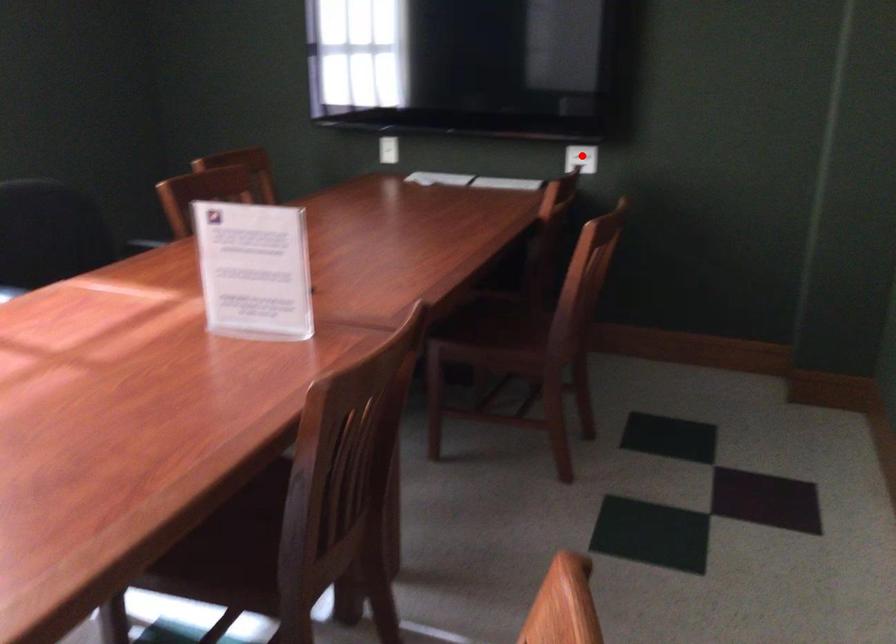
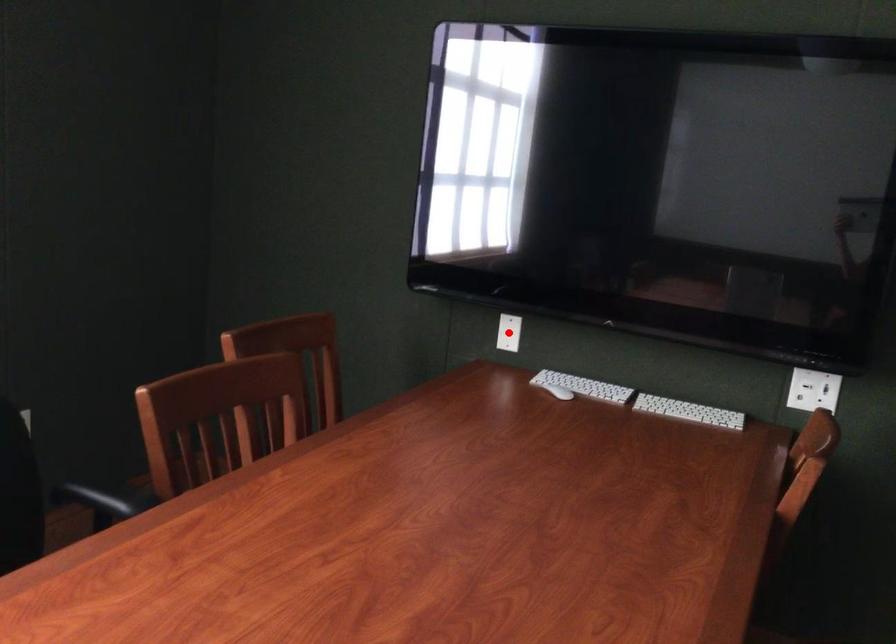
I am providing you with two images of the same scene from different viewpoints. A red point is marked on the first image and another point is marked on the second image. Do the highlighted points in image1 and image2 indicate the same real-world spot?

No